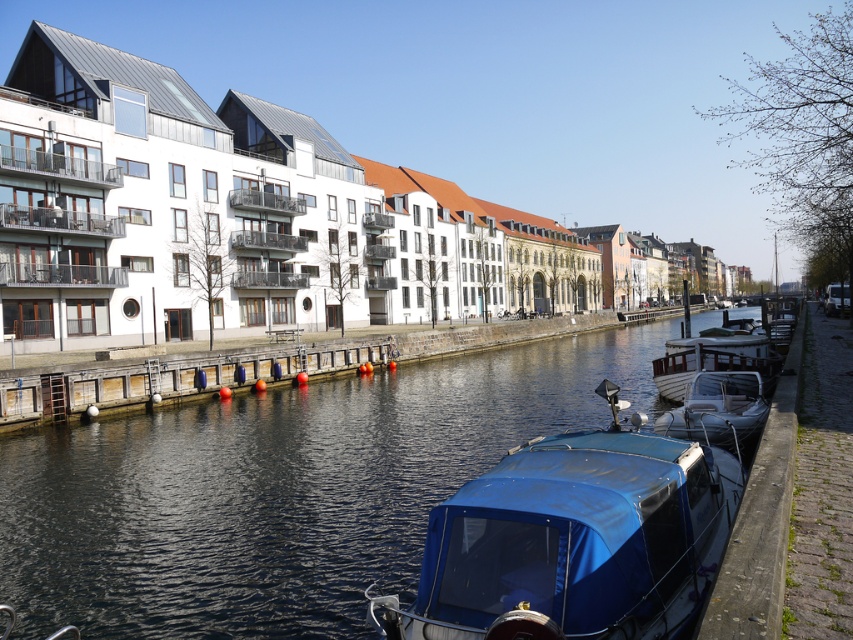
Does blue tarpaulin boat at center appear on the right side of smooth wooden dock at center?

Correct, you'll find blue tarpaulin boat at center to the right of smooth wooden dock at center.

In order to click on blue tarpaulin boat at center in this screenshot , I will do `click(573, 541)`.

Which is more to the left, dark blue water at center or smooth wooden dock at center?

smooth wooden dock at center is more to the left.

Locate an element on the screen. This screenshot has width=853, height=640. dark blue water at center is located at coordinates (280, 490).

Which is more to the right, dark blue water at center or white wooden boat at right?

Positioned to the right is white wooden boat at right.

The width and height of the screenshot is (853, 640). Identify the location of dark blue water at center. (280, 490).